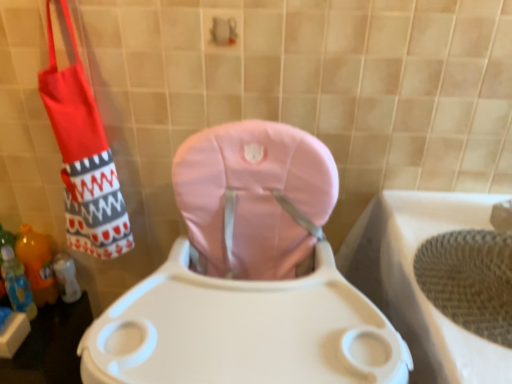
Question: Considering the relative sizes of red fabric shoulder bag at left and pink fabric toilet at center in the image provided, is red fabric shoulder bag at left thinner than pink fabric toilet at center?

Choices:
 (A) yes
 (B) no

Answer: (A)

Question: Is red fabric shoulder bag at left positioned beyond the bounds of pink fabric toilet at center?

Choices:
 (A) no
 (B) yes

Answer: (B)

Question: Is red fabric shoulder bag at left wider than pink fabric toilet at center?

Choices:
 (A) no
 (B) yes

Answer: (A)

Question: From a real-world perspective, is red fabric shoulder bag at left over pink fabric toilet at center?

Choices:
 (A) yes
 (B) no

Answer: (A)

Question: Would you say red fabric shoulder bag at left contains pink fabric toilet at center?

Choices:
 (A) yes
 (B) no

Answer: (B)

Question: From a real-world perspective, relative to red fabric shoulder bag at left, is pink fabric toilet at center vertically above or below?

Choices:
 (A) below
 (B) above

Answer: (A)

Question: Does point (232, 142) appear closer or farther from the camera than point (96, 193)?

Choices:
 (A) farther
 (B) closer

Answer: (B)

Question: Considering the positions of pink fabric toilet at center and red fabric shoulder bag at left in the image, is pink fabric toilet at center taller or shorter than red fabric shoulder bag at left?

Choices:
 (A) tall
 (B) short

Answer: (A)

Question: Looking at the image, does pink fabric toilet at center seem bigger or smaller compared to red fabric shoulder bag at left?

Choices:
 (A) big
 (B) small

Answer: (A)

Question: In the image, is red fabric shoulder bag at left on the left side or the right side of pink fabric toilet at center?

Choices:
 (A) left
 (B) right

Answer: (A)

Question: Looking at the image, does red fabric shoulder bag at left seem bigger or smaller compared to pink fabric toilet at center?

Choices:
 (A) small
 (B) big

Answer: (A)

Question: From the image's perspective, is red fabric shoulder bag at left positioned above or below pink fabric toilet at center?

Choices:
 (A) below
 (B) above

Answer: (B)

Question: Does point (75, 117) appear closer or farther from the camera than point (349, 304)?

Choices:
 (A) farther
 (B) closer

Answer: (A)

Question: Does point (44, 261) appear closer or farther from the camera than point (214, 238)?

Choices:
 (A) closer
 (B) farther

Answer: (B)

Question: From the image's perspective, relative to pink fabric toilet at center, is translucent orange bottle at lower left, which ranks as the 1th bottle in back-to-front order, above or below?

Choices:
 (A) above
 (B) below

Answer: (A)